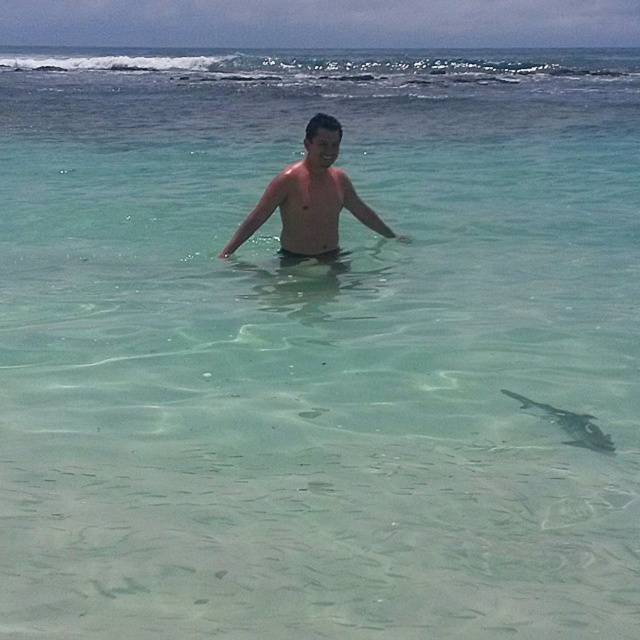
You are a photographer trying to capture the reflection of the person in the water. The reflection is strongest at the point marked by point (308,198). Where should you aim your camera to capture the reflection of the shiny skin at center?

You should aim your camera at the point marked by point (308,198), as this is where the shiny skin at center is located, and reflections in calm water typically mirror the object directly below it.

You are a photographer trying to capture the smooth skin torso at center and the translucent clear fish at lower right in the same frame. Which object should you position closer to the camera to ensure both are in focus?

To ensure both the smooth skin torso at center and the translucent clear fish at lower right are in focus, position the smooth skin torso at center closer to the camera since it is already to the left of the fish, allowing for a greater depth of field.

Looking at this image, you are a lifeguard observing someone in the water. You notice two areas of skin on the person at center. The shiny skin at center and the smooth skin torso at center. Which area is higher up on the body?

The shiny skin at center is located above the smooth skin torso at center, so the shiny skin at center is higher up on the body.